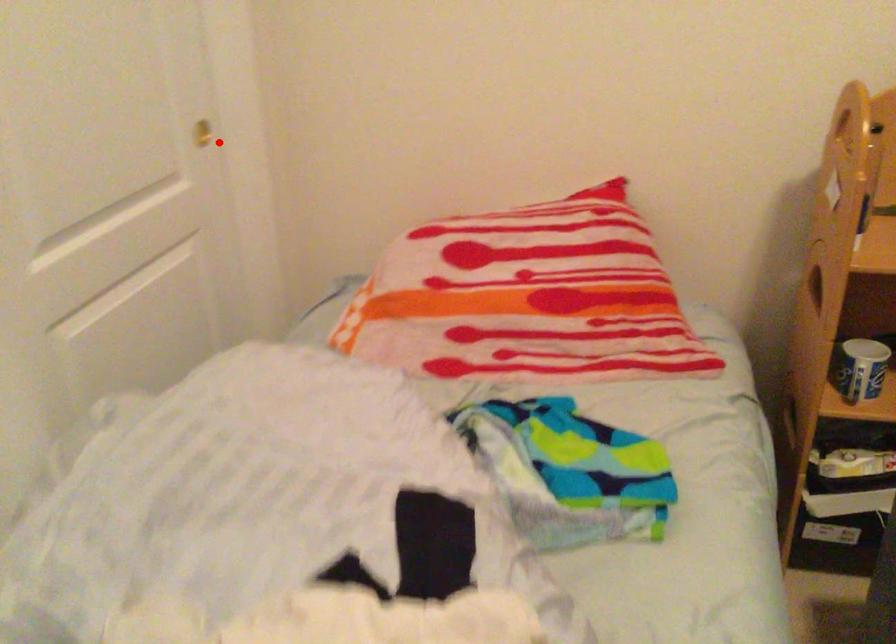
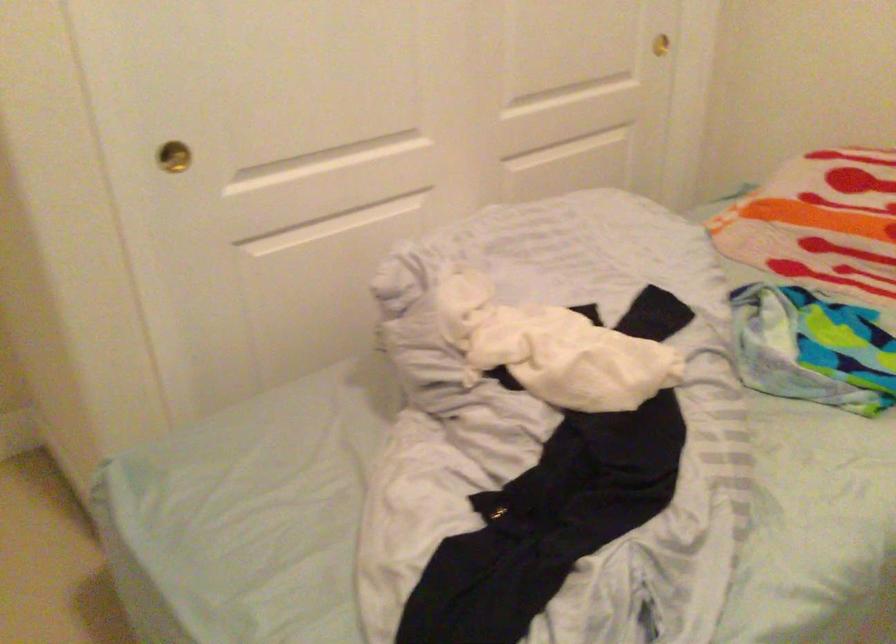
Locate, in the second image, the point that corresponds to the highlighted location in the first image.

(664, 44)